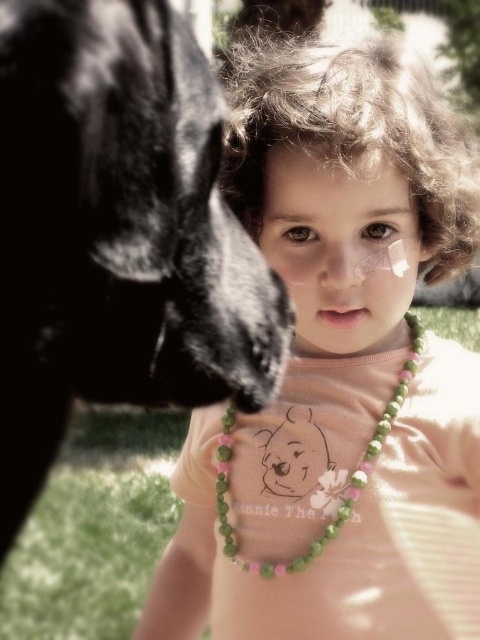
Question: Is pink matte necklace at upper center smaller than matte skin nose at center?

Choices:
 (A) no
 (B) yes

Answer: (A)

Question: Can you confirm if green beaded necklace at center is thinner than matte skin nose at center?

Choices:
 (A) no
 (B) yes

Answer: (A)

Question: Among these objects, which one is farthest from the camera?

Choices:
 (A) green beaded necklace at center
 (B) pink matte necklace at upper center
 (C) matte skin nose at center
 (D) black fur dog at left

Answer: (A)

Question: Which of the following is the farthest from the observer?

Choices:
 (A) (240, 310)
 (B) (226, 556)
 (C) (391, 288)
 (D) (325, 257)

Answer: (B)

Question: Estimate the real-world distances between objects in this image. Which object is farther from the matte skin nose at center?

Choices:
 (A) black fur dog at left
 (B) green beaded necklace at center
 (C) pink matte necklace at upper center

Answer: (A)

Question: Is black fur dog at left smaller than matte skin nose at center?

Choices:
 (A) yes
 (B) no

Answer: (B)